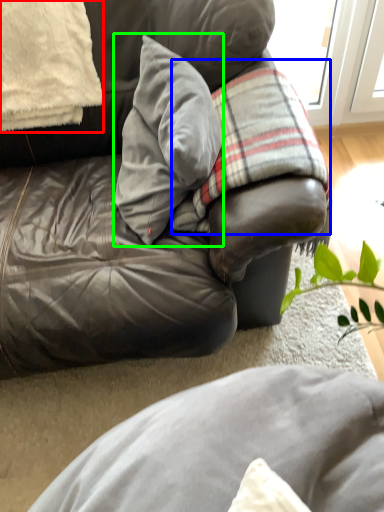
Question: Which is nearer to the pillow (highlighted by a red box)? plaid (highlighted by a blue box) or pillow (highlighted by a green box).

Choices:
 (A) plaid
 (B) pillow

Answer: (B)